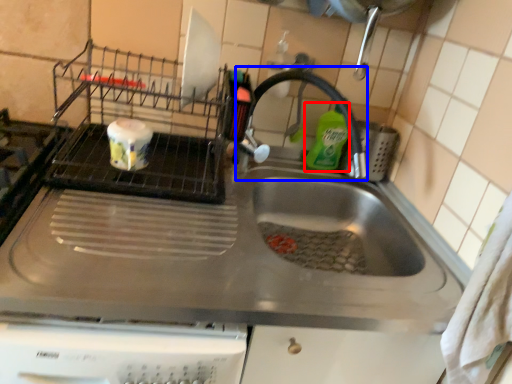
Question: Which of the following is the farthest to the observer, cleaning product (highlighted by a red box) or faucet (highlighted by a blue box)?

Choices:
 (A) cleaning product
 (B) faucet

Answer: (A)